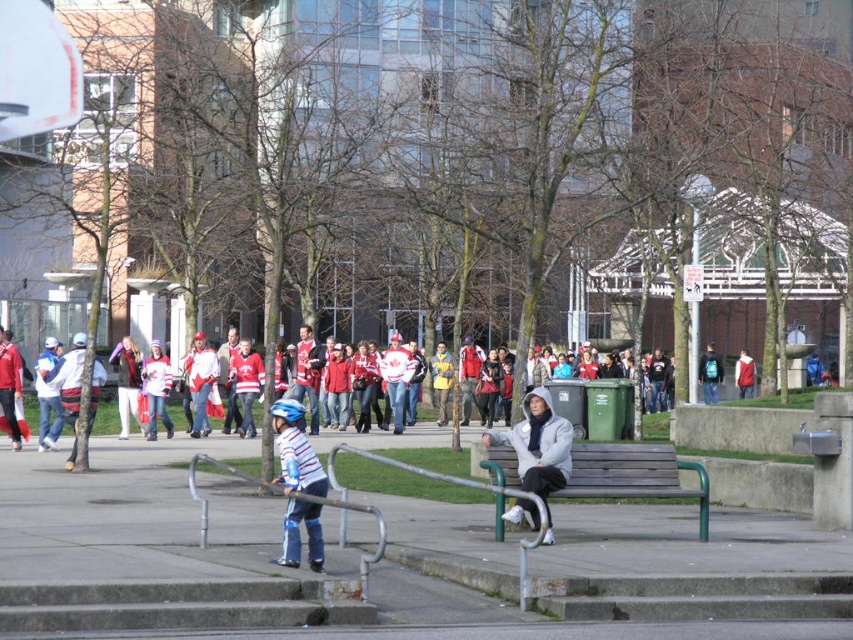
Question: Based on their relative distances, which object is farther from the white jersey at center?

Choices:
 (A) red fabric jacket at center
 (B) blue helmet at center
 (C) matte gray hoodie at center

Answer: (A)

Question: Which object appears closest to the camera in this image?

Choices:
 (A) teal backpack at center-right
 (B) red fabric jacket at center
 (C) white jersey at center

Answer: (C)

Question: Does blue helmet at center come behind teal backpack at center-right?

Choices:
 (A) no
 (B) yes

Answer: (A)

Question: Is blue helmet at center thinner than white jersey at center?

Choices:
 (A) yes
 (B) no

Answer: (A)

Question: Does white jersey at center have a lesser width compared to red fabric jacket at center?

Choices:
 (A) yes
 (B) no

Answer: (B)

Question: Estimate the real-world distances between objects in this image. Which object is closer to the blue helmet at center?

Choices:
 (A) white jersey at center
 (B) matte gray hoodie at center

Answer: (B)